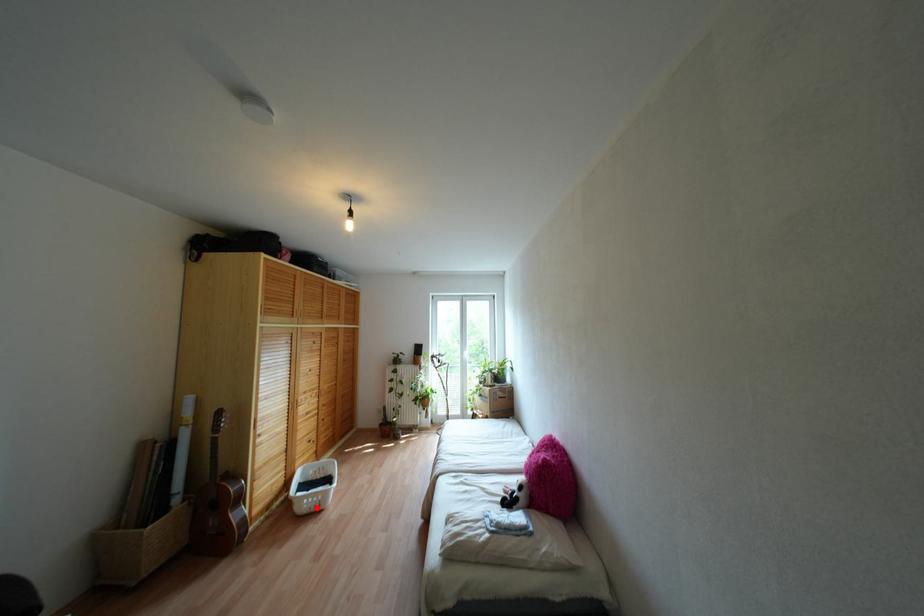
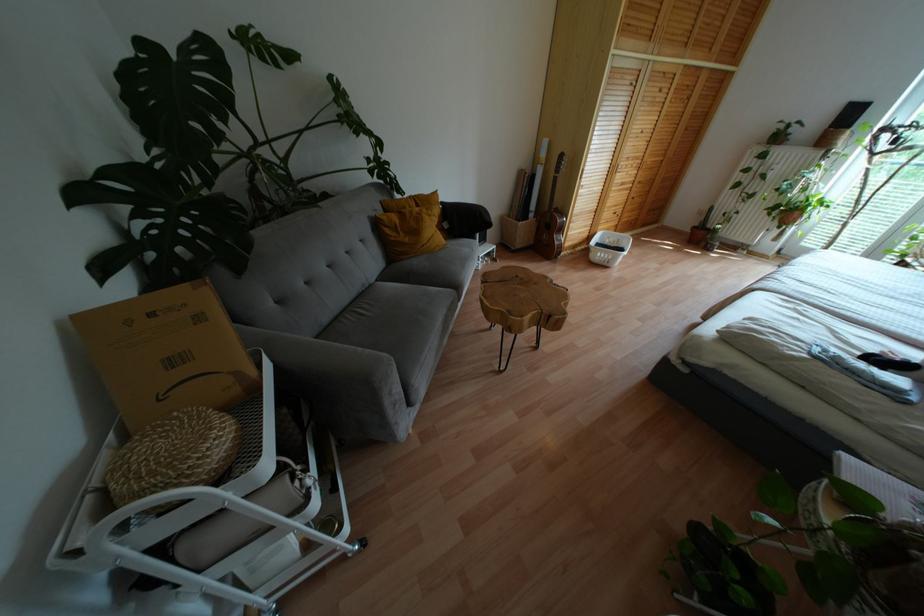
In the second image, find the point that corresponds to the highlighted location in the first image.

(604, 262)